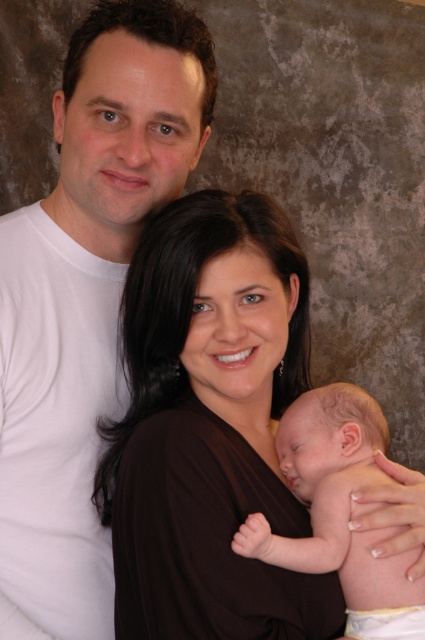
You are a photographer standing at a distance of 32 inches from the family portrait. You want to focus your camera on the brown matte dress at center. Will the dress be in focus if your camera has a depth of field that can clearly capture objects within 31 inches to 33 inches from the lens? Please explain your reasoning.

The brown matte dress at center is 31.98 inches from the viewer. Since the camera can focus on objects between 31 inches and 33 inches away, the dress is within this range. Therefore, the dress will be in focus.